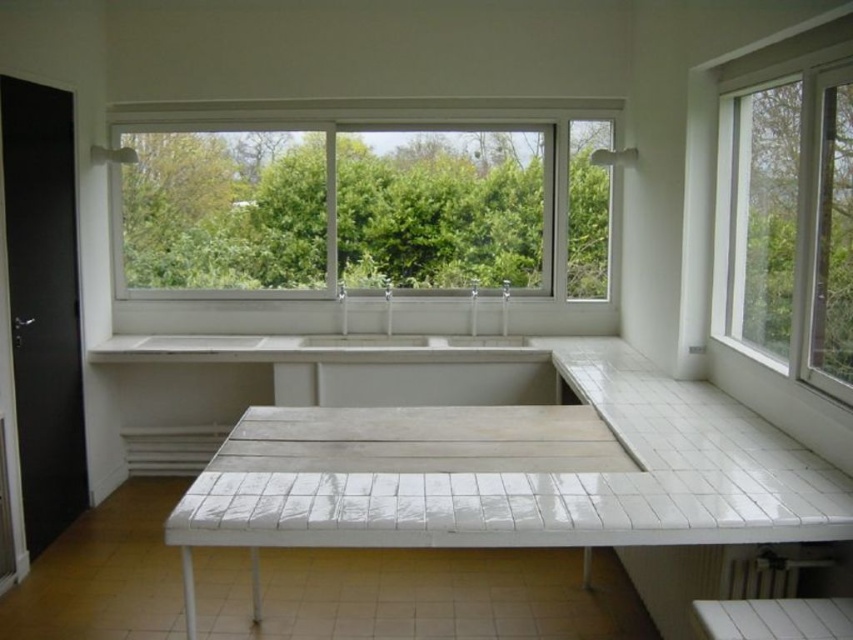
Can you confirm if white ceramic sink at center is bigger than white glossy sink at center?

Correct, white ceramic sink at center is larger in size than white glossy sink at center.

Which of these two, white ceramic sink at center or white glossy sink at center, stands shorter?

white glossy sink at center

Which is in front, point (334, 340) or point (444, 346)?

Point (444, 346) is more forward.

Find the location of a particular element. The width and height of the screenshot is (853, 640). white ceramic sink at center is located at coordinates (364, 336).

Is clear glass window at center closer to the viewer compared to white tile table at center?

No, clear glass window at center is further to the viewer.

Is point (599, 285) positioned before point (485, 410)?

No, (599, 285) is further to viewer.

This screenshot has width=853, height=640. In order to click on clear glass window at center in this screenshot , I will do `click(361, 205)`.

Locate an element on the screen. The image size is (853, 640). clear glass window at center is located at coordinates (361, 205).

Find the location of `clear glass window at center`. clear glass window at center is located at coordinates (361, 205).